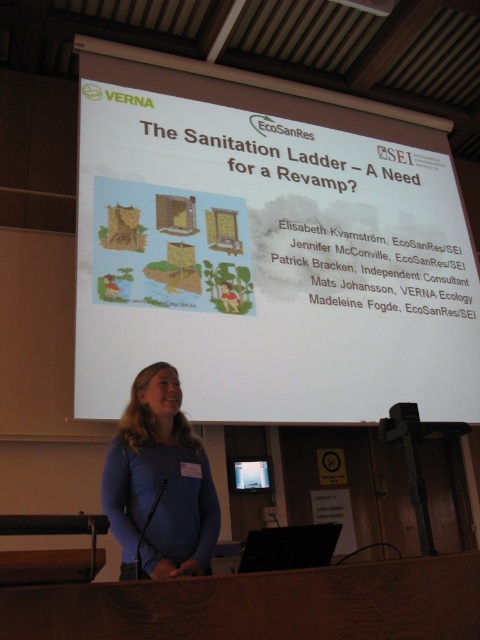
Consider the image. Between matte blue shirt at center and matte black screen at center, which one has less height?

With less height is matte black screen at center.

Who is more distant from viewer, (195, 483) or (265, 468)?

Positioned behind is point (265, 468).

The height and width of the screenshot is (640, 480). I want to click on matte blue shirt at center, so click(x=159, y=483).

Can you confirm if white matte projector screen at upper center is wider than matte black screen at center?

Yes.

Who is shorter, white matte projector screen at upper center or matte black screen at center?

matte black screen at center

Locate an element on the screen. white matte projector screen at upper center is located at coordinates (267, 246).

At what (x,y) coordinates should I click in order to perform the action: click on white matte projector screen at upper center. Please return your answer as a coordinate pair (x, y). This screenshot has height=640, width=480. Looking at the image, I should click on pos(267,246).

Does point (471, 388) lie behind point (200, 564)?

Yes, point (471, 388) is farther from viewer.

Between point (348, 396) and point (136, 385), which one is positioned behind?

Positioned behind is point (348, 396).

Find the location of a particular element. white matte projector screen at upper center is located at coordinates (267, 246).